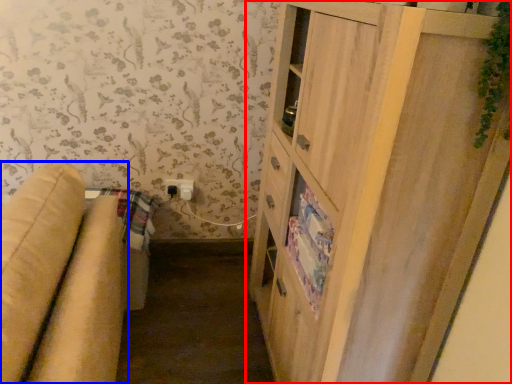
Question: Which object is closer to the camera taking this photo, cupboard (highlighted by a red box) or studio couch (highlighted by a blue box)?

Choices:
 (A) cupboard
 (B) studio couch

Answer: (B)